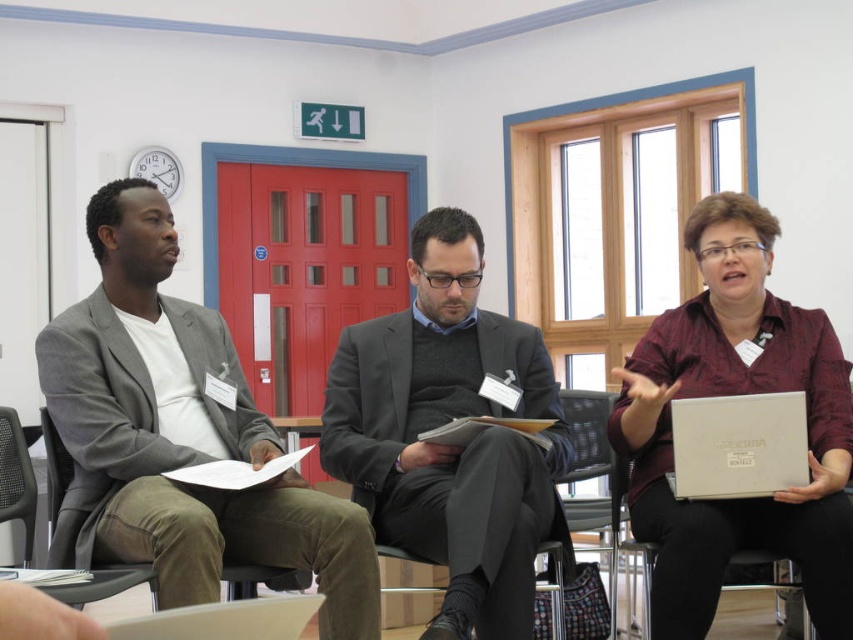
Question: Can you confirm if matte white laptop at center right is wider than dark gray fabric chair at left?

Choices:
 (A) no
 (B) yes

Answer: (A)

Question: Is matte gray blazer at left behind white matte laptop at center?

Choices:
 (A) yes
 (B) no

Answer: (B)

Question: Which of the following is the closest to the observer?

Choices:
 (A) (570, 474)
 (B) (764, 224)
 (C) (6, 452)

Answer: (B)

Question: Is white matte laptop at center closer to the viewer compared to dark gray fabric chair at left?

Choices:
 (A) yes
 (B) no

Answer: (B)

Question: Which point appears closest to the camera in this image?

Choices:
 (A) (171, 264)
 (B) (67, 593)

Answer: (B)

Question: Estimate the real-world distances between objects in this image. Which object is closer to the matte white laptop at center right?

Choices:
 (A) white matte laptop at center
 (B) dark gray fabric chair at left

Answer: (A)